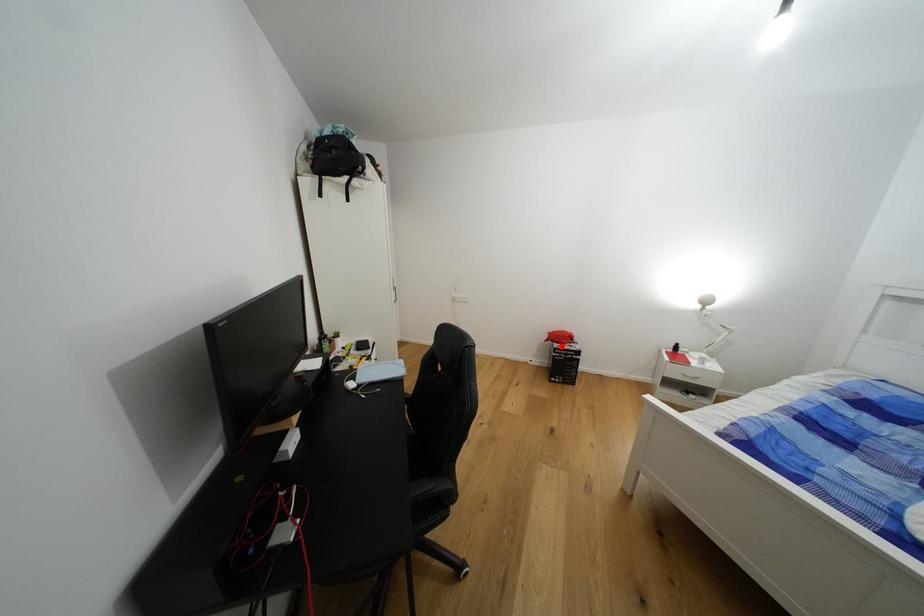
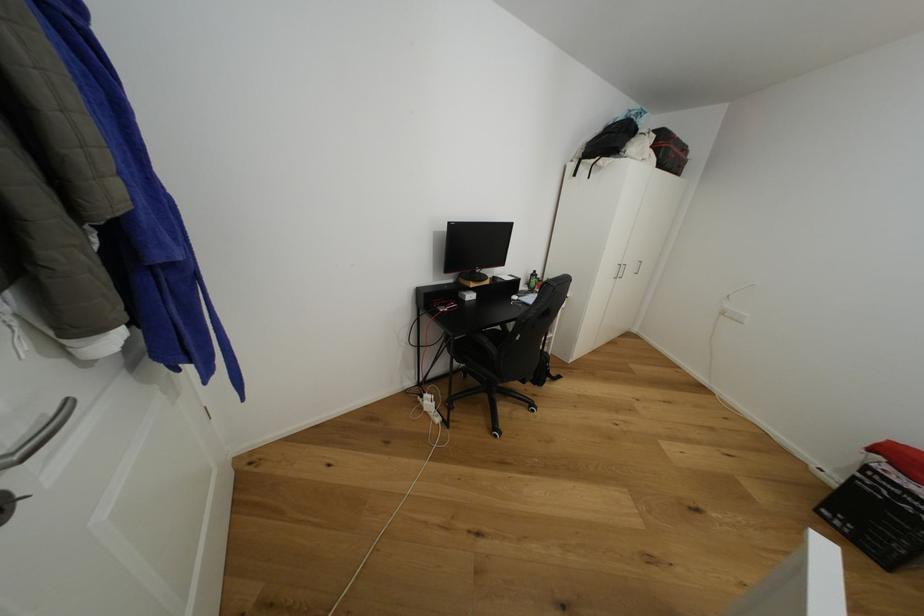
Locate, in the second image, the point that corresponds to the highlighted location in the first image.

(893, 469)